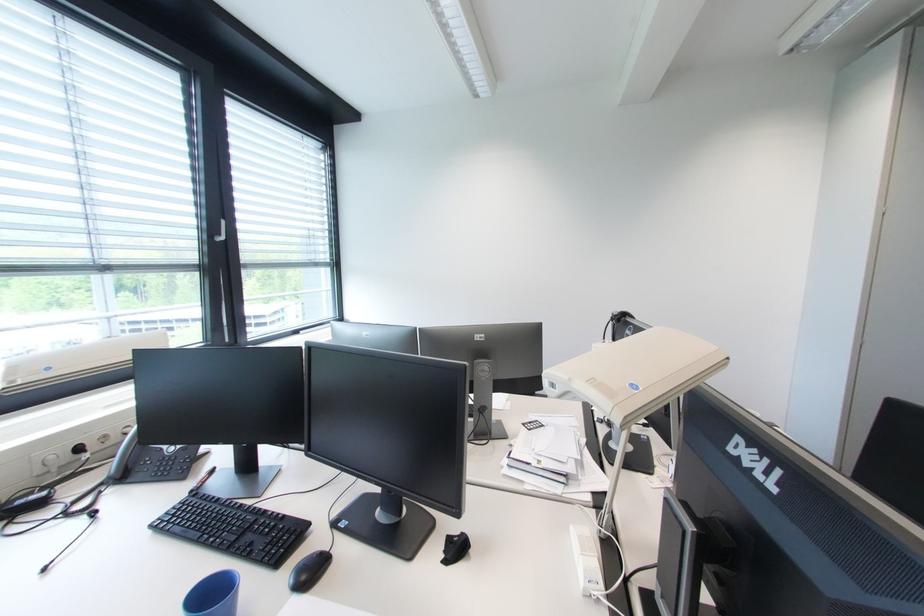
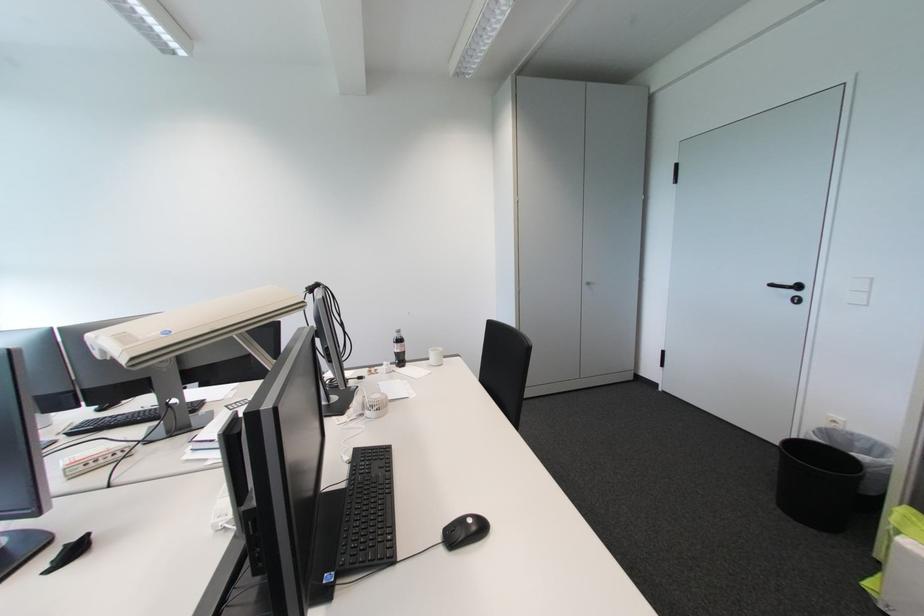
Question: The camera is either moving clockwise (left) or counter-clockwise (right) around the object. The first image is from the beginning of the video and the second image is from the end. Is the camera moving left or right when shooting the video?

Choices:
 (A) Left
 (B) Right

Answer: (A)